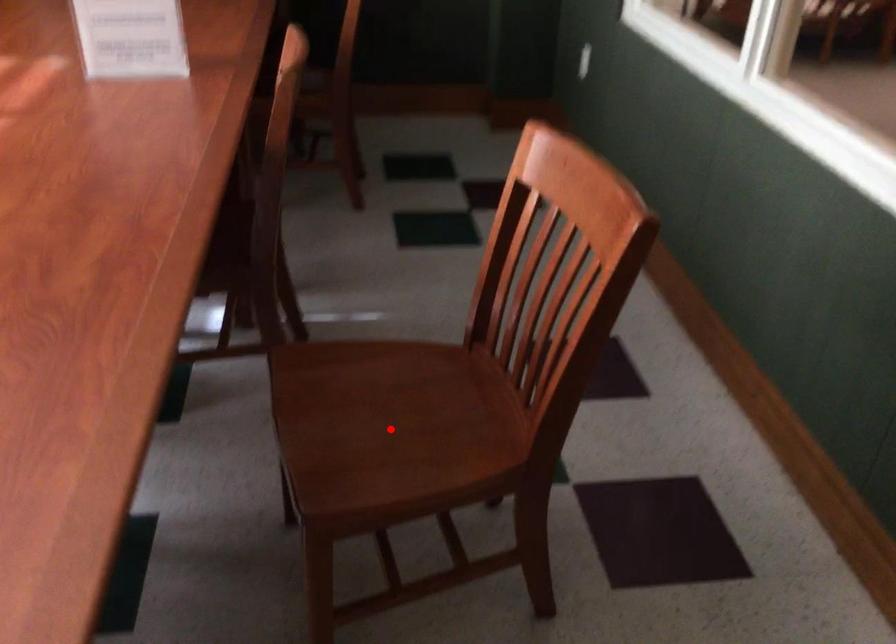
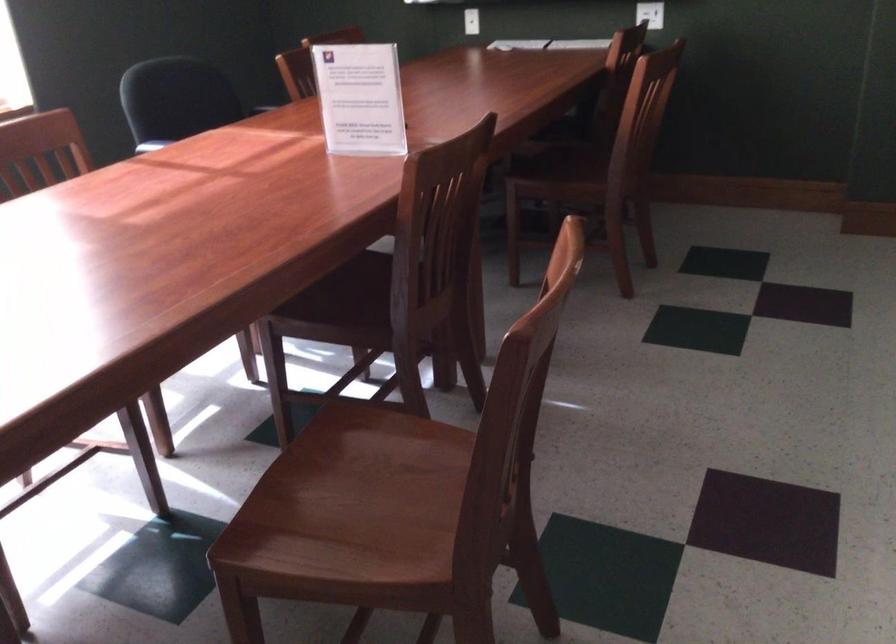
Question: I am providing you with two images of the same scene from different viewpoints. A red point is marked on the first image. Is the red point's position out of view in image 2?

Choices:
 (A) Yes
 (B) No

Answer: (B)